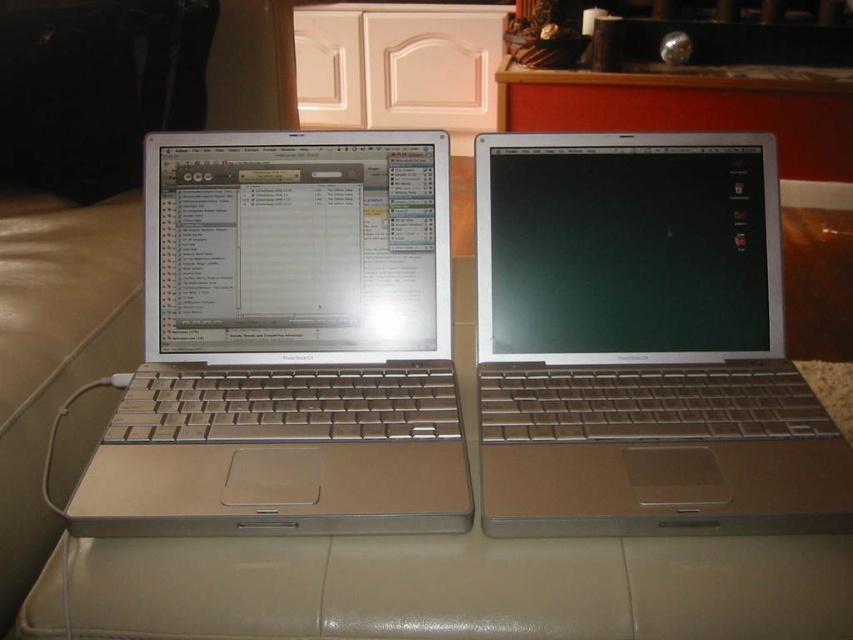
Question: Which point is farther from the camera taking this photo?

Choices:
 (A) (637, 371)
 (B) (274, 147)

Answer: (B)

Question: Can you confirm if silver metallic laptop at left is positioned to the left of satin silver laptop at center?

Choices:
 (A) yes
 (B) no

Answer: (A)

Question: Is silver metallic laptop at left further to the viewer compared to satin silver laptop at center?

Choices:
 (A) yes
 (B) no

Answer: (A)

Question: Which point is closer to the camera taking this photo?

Choices:
 (A) (614, 147)
 (B) (337, 525)

Answer: (B)

Question: Which of the following is the closest to the observer?

Choices:
 (A) (154, 484)
 (B) (819, 404)

Answer: (A)

Question: Is silver metallic laptop at left thinner than satin silver laptop at center?

Choices:
 (A) no
 (B) yes

Answer: (A)